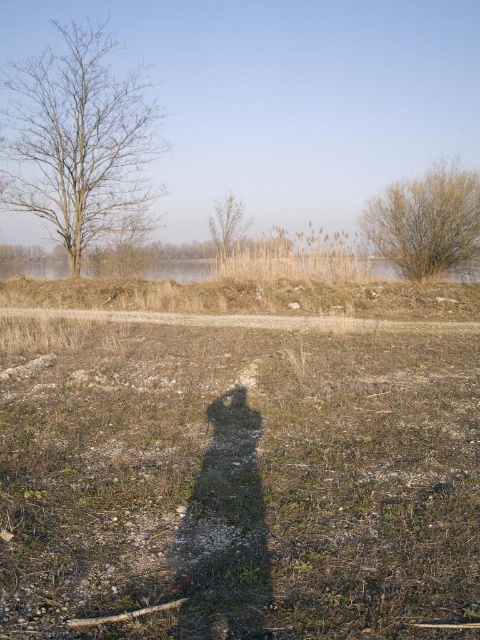
You are standing in the serene outdoor scene and want to take a photo of the green leafy bush at upper right. Where should you position yourself to capture it in the frame?

To capture the green leafy bush at upper right in your photo, position yourself so that the bush is located at the coordinates point (427,224) in the frame.

You are standing on the brown gravelly dirt field at center and want to walk to the bare wood tree at center. Since both are at the center, how do you determine which direction to go?

The brown gravelly dirt field at center has a larger width than the bare wood tree at center, so you should walk towards the narrower area to reach the bare wood tree at center.

You are standing on the dirt path and want to walk to the green leafy bush at upper right without stepping on the brown gravelly dirt field at center. Is this possible?

The brown gravelly dirt field at center is positioned on the left side of green leafy bush at upper right. Therefore, you can walk around the right side of the brown gravelly dirt field at center to reach the green leafy bush at upper right without stepping on it.